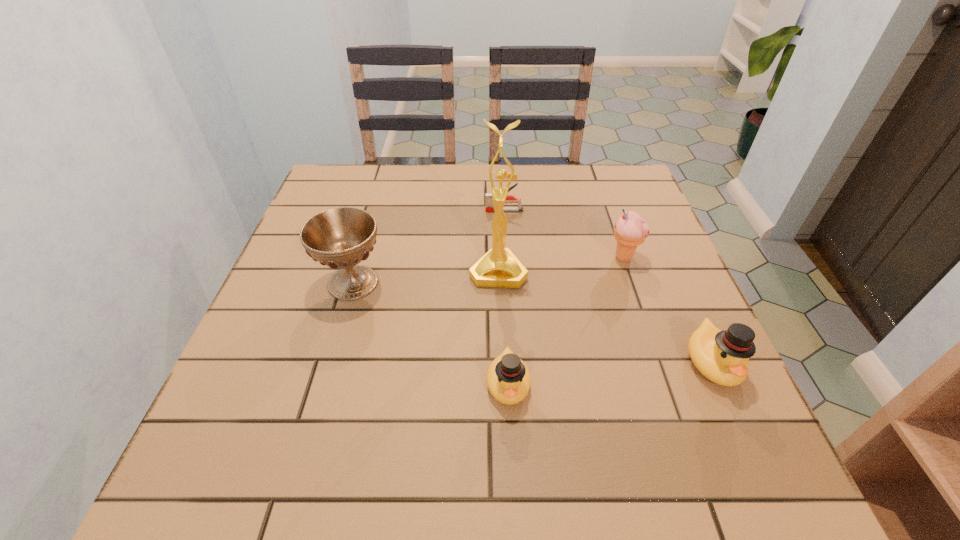
This screenshot has width=960, height=540. Identify the location of vacant space at the left edge. (312, 279).

I want to click on vacant space at the right edge of the desktop, so click(x=662, y=326).

Locate an element on the screen. vacant region at the far right corner of the desktop is located at coordinates (614, 178).

In the image, there is a desktop. Find the location of `vacant space at the near right corner`. vacant space at the near right corner is located at coordinates (731, 403).

In order to click on free space that is in between the fourth tallest object and the icecream in this screenshot , I will do `click(667, 310)`.

Where is `vacant area between the chalice and the fourth tallest object`? vacant area between the chalice and the fourth tallest object is located at coordinates (533, 322).

Locate an element on the screen. This screenshot has height=540, width=960. vacant area that lies between the shorter duck and the farthest object is located at coordinates (506, 297).

Locate an element on the screen. The image size is (960, 540). vacant space that is in between the third shortest object and the farthest object is located at coordinates (608, 287).

The height and width of the screenshot is (540, 960). Find the location of `vacant area that lies between the leftmost object and the rightmost object`. vacant area that lies between the leftmost object and the rightmost object is located at coordinates (533, 322).

At what (x,y) coordinates should I click in order to perform the action: click on vacant area that lies between the stapler and the shorter duck. Please return your answer as a coordinate pair (x, y). This screenshot has height=540, width=960. Looking at the image, I should click on (506, 297).